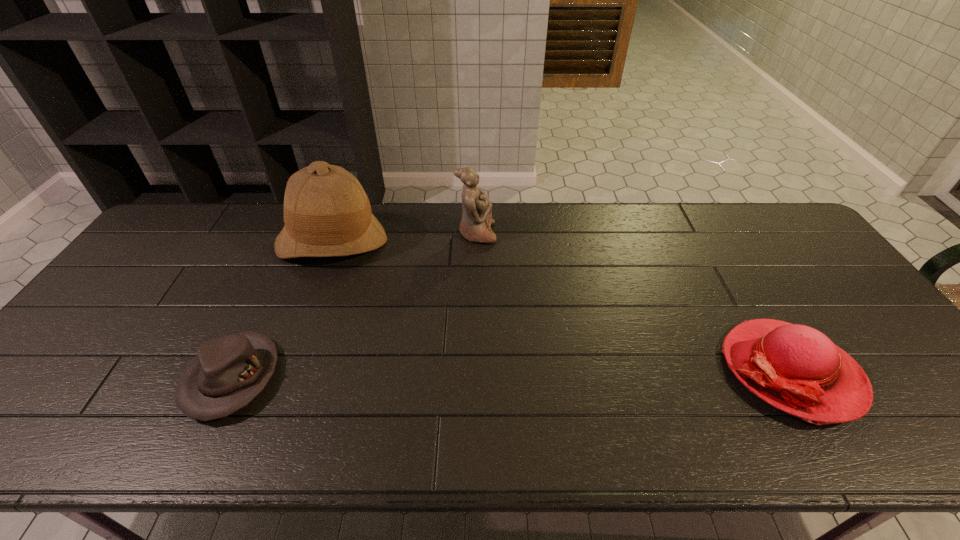
Find the location of a particular element. This screenshot has height=540, width=960. vacant area situated at the front of the rightmost object with a bow is located at coordinates (655, 371).

I want to click on hat that is at the far edge, so click(327, 213).

Identify the location of figurine situated at the far edge. The height and width of the screenshot is (540, 960). (475, 226).

You are a GUI agent. You are given a task and a screenshot of the screen. Output one action in this format:
    pyautogui.click(x=<x>, y=<y>)
    Task: Click on the object present at the right edge
    
    Given the screenshot: What is the action you would take?
    pyautogui.click(x=797, y=369)

Find the location of `object that is positioned at the near right corner`. object that is positioned at the near right corner is located at coordinates (797, 369).

The height and width of the screenshot is (540, 960). What are the coordinates of `vacant space at the far edge of the desktop` in the screenshot? It's located at (646, 229).

What are the coordinates of `free space at the near edge of the desktop` in the screenshot? It's located at (542, 422).

At what (x,y) coordinates should I click in order to perform the action: click on free spot at the left edge of the desktop. Please return your answer as a coordinate pair (x, y). The width and height of the screenshot is (960, 540). Looking at the image, I should click on (144, 252).

Where is `vacant space at the right edge`? The height and width of the screenshot is (540, 960). vacant space at the right edge is located at coordinates tap(772, 257).

Locate an element on the screen. free region at the far left corner is located at coordinates (183, 208).